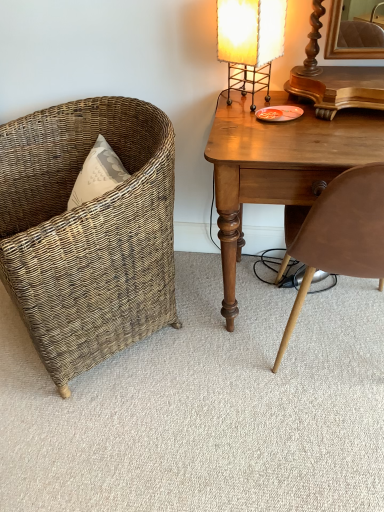
This screenshot has height=512, width=384. I want to click on vacant area that is in front of brown leather chair at right, the 2th chair in the left-to-right sequence, so pyautogui.click(x=318, y=447).